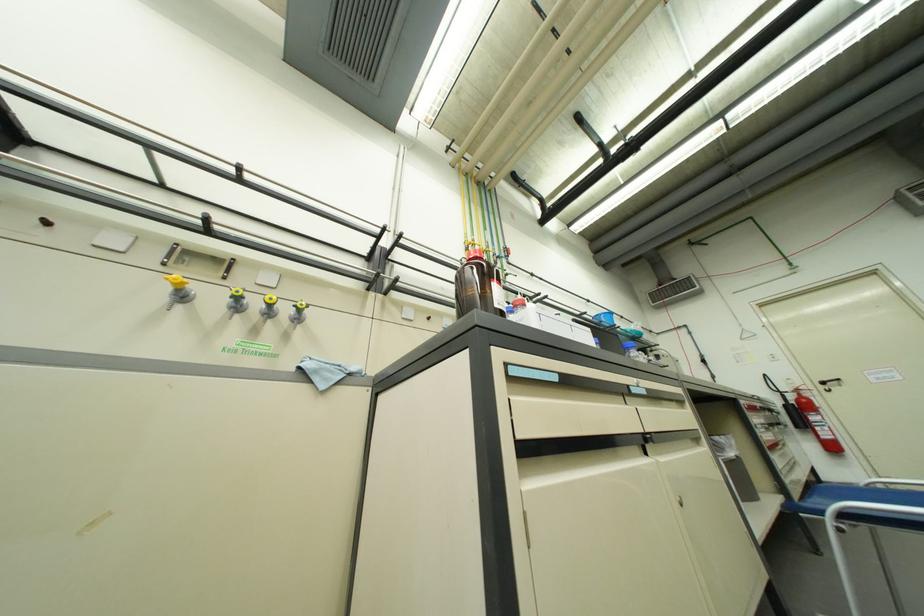
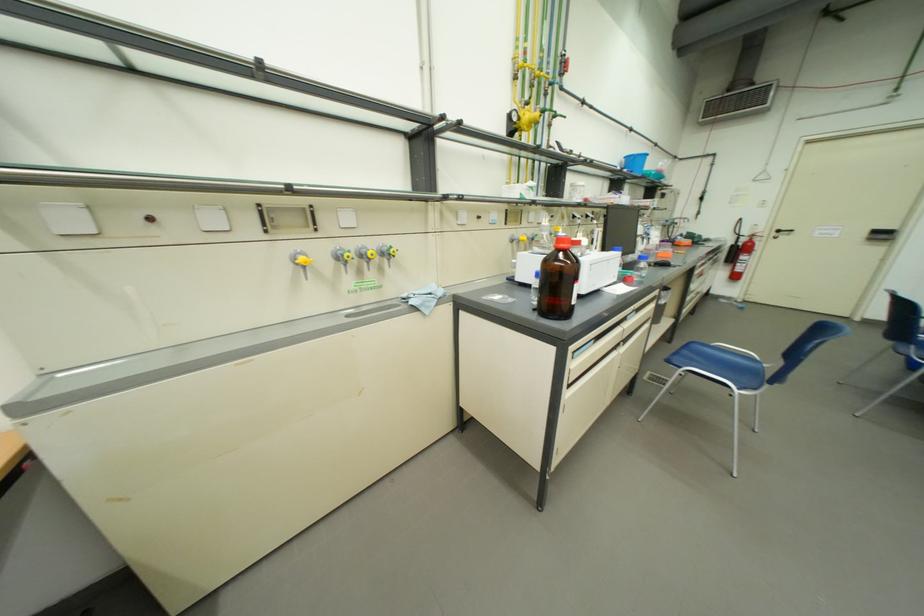
The point at [833,384] is marked in the first image. Where is the corresponding point in the second image?

(787, 233)